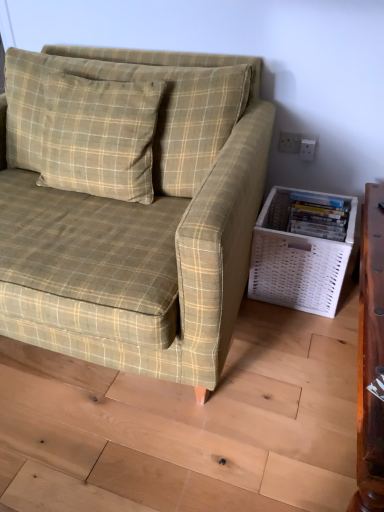
Question: Is green plaid fabric couch at center wider or thinner than white woven basket at lower right?

Choices:
 (A) thin
 (B) wide

Answer: (B)

Question: Is green plaid fabric couch at center taller or shorter than white woven basket at lower right?

Choices:
 (A) tall
 (B) short

Answer: (A)

Question: Which is nearer to the green plaid fabric couch at center?

Choices:
 (A) green plaid pillow at upper left
 (B) white woven basket at lower right
 (C) white plastic electric outlet at upper right

Answer: (A)

Question: Estimate the real-world distances between objects in this image. Which object is closer to the white plastic electric outlet at upper right?

Choices:
 (A) white woven basket at lower right
 (B) green plaid pillow at upper left
 (C) green plaid fabric couch at center

Answer: (A)